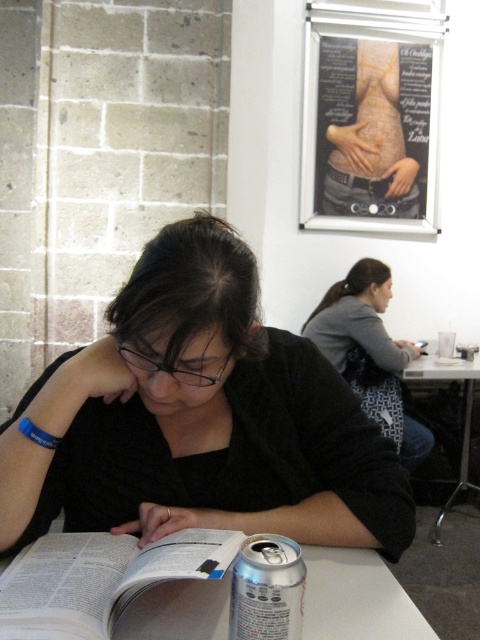
You are trying to decide whether to place a new menu board between the gray fabric shirt at upper right and the silver metallic can at lower center. Considering their sizes, which object should the menu board be placed closer to for it to fit better?

The gray fabric shirt at upper right has a larger size compared to the silver metallic can at lower center, so the menu board should be placed closer to the gray fabric shirt at upper right to accommodate its larger size.

Where is the black matte book at center located in the image?

The black matte book at center is located at point 0.655 on the x axis and 0.415 on the y axis.